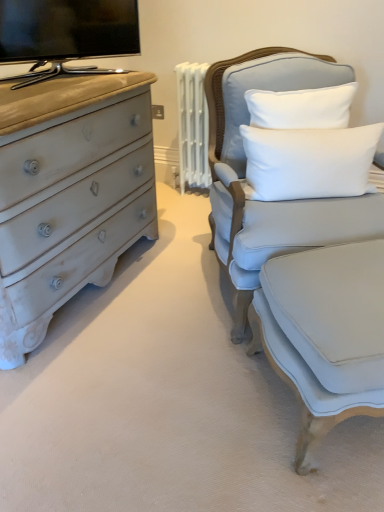
Question: Is flat-screen tv at upper left positioned with its back to light blue fabric swivel chair at right?

Choices:
 (A) no
 (B) yes

Answer: (A)

Question: Is flat-screen tv at upper left outside of light blue fabric swivel chair at right?

Choices:
 (A) yes
 (B) no

Answer: (A)

Question: From the image's perspective, would you say flat-screen tv at upper left is shown under light blue fabric swivel chair at right?

Choices:
 (A) no
 (B) yes

Answer: (A)

Question: Does flat-screen tv at upper left have a larger size compared to light blue fabric swivel chair at right?

Choices:
 (A) no
 (B) yes

Answer: (A)

Question: Can you confirm if flat-screen tv at upper left is thinner than light blue fabric swivel chair at right?

Choices:
 (A) yes
 (B) no

Answer: (A)

Question: Could light blue fabric swivel chair at right be considered to be inside flat-screen tv at upper left?

Choices:
 (A) yes
 (B) no

Answer: (B)

Question: Considering the relative sizes of white soft cushion at upper right and light gray fabric chair at right in the image provided, is white soft cushion at upper right bigger than light gray fabric chair at right?

Choices:
 (A) yes
 (B) no

Answer: (B)

Question: Is white soft cushion at upper right turned away from light gray fabric chair at right?

Choices:
 (A) no
 (B) yes

Answer: (B)

Question: From the image's perspective, is white soft cushion at upper right under light gray fabric chair at right?

Choices:
 (A) yes
 (B) no

Answer: (B)

Question: Is white soft cushion at upper right outside light gray fabric chair at right?

Choices:
 (A) yes
 (B) no

Answer: (B)

Question: Can you confirm if white soft cushion at upper right is shorter than light gray fabric chair at right?

Choices:
 (A) no
 (B) yes

Answer: (B)

Question: From a real-world perspective, does white soft cushion at upper right stand above light gray fabric chair at right?

Choices:
 (A) no
 (B) yes

Answer: (B)

Question: From a real-world perspective, is light gray fabric chair at right below flat-screen tv at upper left?

Choices:
 (A) yes
 (B) no

Answer: (A)